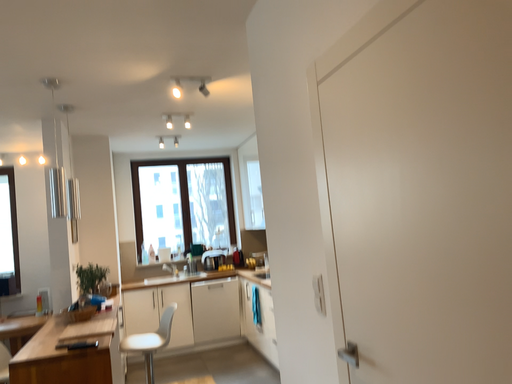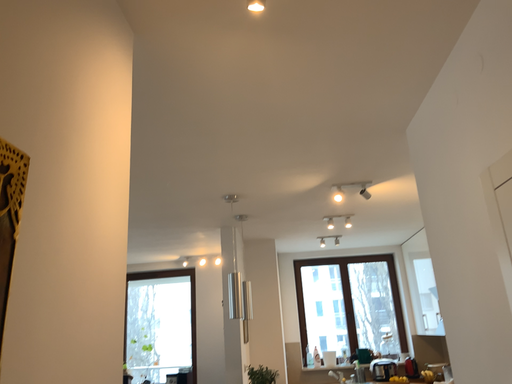
Question: Which way did the camera rotate in the video?

Choices:
 (A) rotated left
 (B) rotated right

Answer: (A)